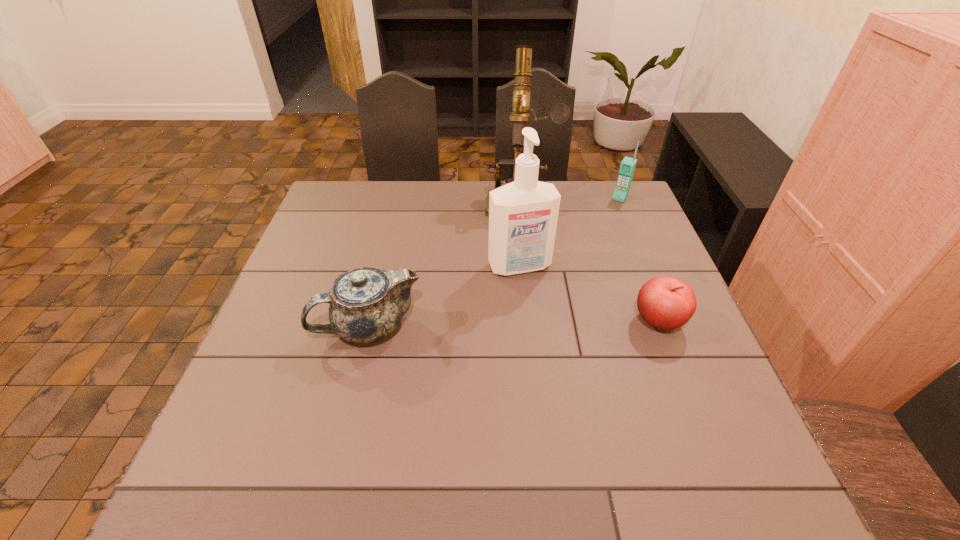
The width and height of the screenshot is (960, 540). Find the location of `apple present at the right edge`. apple present at the right edge is located at coordinates (666, 303).

Identify the location of cellular telephone that is positioned at the right edge. (627, 167).

In order to click on object that is at the far right corner in this screenshot , I will do `click(627, 167)`.

Find the location of a particular element. free space at the far edge of the desktop is located at coordinates (450, 183).

Identify the location of blank space at the left edge of the desktop. (341, 251).

You are a GUI agent. You are given a task and a screenshot of the screen. Output one action in this format:
    pyautogui.click(x=<x>, y=<y>)
    Task: Click on the free point at the right edge
    This screenshot has width=960, height=540.
    Given the screenshot: What is the action you would take?
    pyautogui.click(x=610, y=239)

This screenshot has height=540, width=960. Find the location of `free region at the far left corner of the desktop`. free region at the far left corner of the desktop is located at coordinates (346, 185).

At what (x,y) coordinates should I click in order to perform the action: click on vacant space at the near left corner of the desktop. Please return your answer as a coordinate pair (x, y). This screenshot has width=960, height=540. Looking at the image, I should click on (251, 407).

At what (x,y) coordinates should I click in order to perform the action: click on vacant region at the far right corner. Please return your answer as a coordinate pair (x, y). Looking at the image, I should click on (587, 187).

Locate an element on the screen. The width and height of the screenshot is (960, 540). free point between the microscope and the apple is located at coordinates pos(589,260).